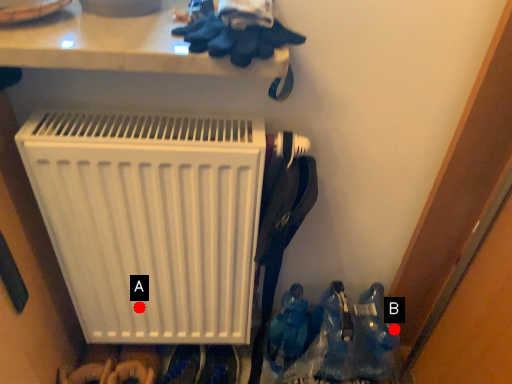
Question: Two points are circled on the image, labeled by A and B beside each circle. Which point is farther to the camera?

Choices:
 (A) A is further
 (B) B is further

Answer: (B)